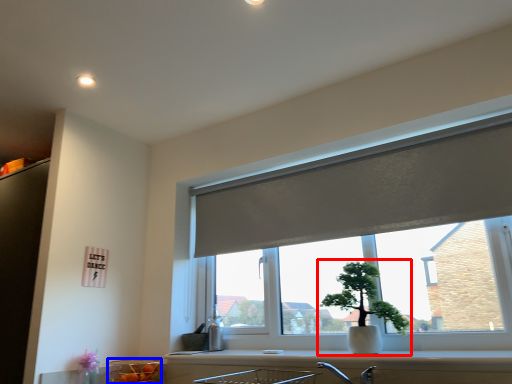
Question: Which object is closer to the camera taking this photo, houseplant (highlighted by a red box) or glass bowl (highlighted by a blue box)?

Choices:
 (A) houseplant
 (B) glass bowl

Answer: (A)